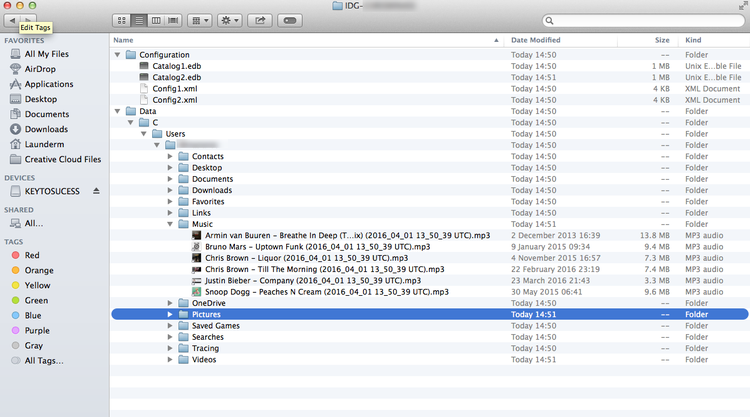
Locate an element on the screen. files is located at coordinates (169, 67), (171, 75), (174, 84), (166, 98), (231, 235), (228, 242), (231, 259), (231, 267), (232, 279), (232, 292).